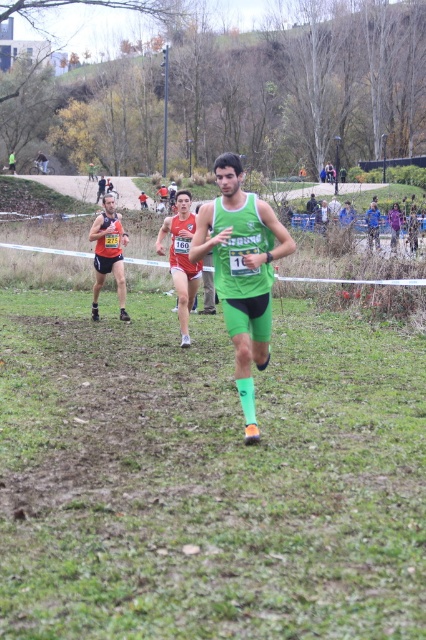
You are a photographer at the cross country race and want to capture a photo of both the green matte triathlon suit at center and the orange mesh tank top at left. Since you want both to be in focus, you need to know which one is taller. Can you tell me which one is taller?

The green matte triathlon suit at center is taller than the orange mesh tank top at left.

You are a race official trying to determine if the green matte triathlon suit at center can safely overtake the orange mesh tank top at left within the next 10 seconds. The green runner maintains a constant speed of 5 meters per second, while the orange runner is moving at 4 meters per second. Can the green runner overtake the orange runner within this time frame?

The distance between the green matte triathlon suit at center and the orange mesh tank top at left is 3.85 meters. The green runner is behind and needs to cover this distance plus any additional distance the orange runner covers. The relative speed difference is 5 mps minus 4 mps equals 1 mps. To overtake, the green needs to cover 3.85 meters at 1 mps, which would take 3.85 seconds. Since 3.85 seconds is less than 10 seconds, yes, the green runner can overtake within the next 10 seconds.